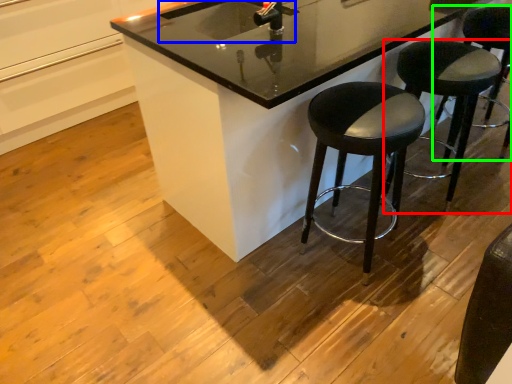
Question: Which object is positioned closest to stool (highlighted by a red box)? Select from sink (highlighted by a blue box) and stool (highlighted by a green box).

Choices:
 (A) sink
 (B) stool

Answer: (B)